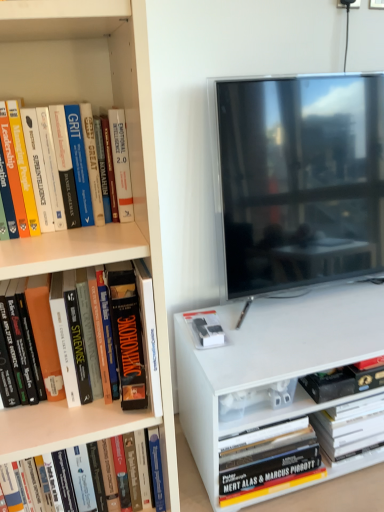
Question: From the image's perspective, is black matte book at lower right, which ranks as the second book in right-to-left order, located above or below hardcover book at lower left, positioned as the third book in back-to-front order?

Choices:
 (A) below
 (B) above

Answer: (B)

Question: Considering the positions of black matte book at lower right, which is the second book from back to front, and hardcover book at lower left, marked as the 2th book in a left-to-right arrangement, in the image, is black matte book at lower right, which is the second book from back to front, taller or shorter than hardcover book at lower left, marked as the 2th book in a left-to-right arrangement,?

Choices:
 (A) tall
 (B) short

Answer: (B)

Question: Estimate the real-world distances between objects in this image. Which object is closer to the orange matte book at left, which ranks as the 1th book in front-to-back order?

Choices:
 (A) flat-screen tv at right
 (B) hardcover book at lower right, which is counted as the first book, starting from the back
 (C) hardcover book at lower left, marked as the 2th book in a left-to-right arrangement
 (D) black matte book at lower right, which is the second book from back to front

Answer: (C)

Question: Which is nearer to the flat-screen tv at right?

Choices:
 (A) hardcover book at lower right, which is counted as the first book, starting from the back
 (B) orange matte book at left, placed as the fourth book when sorted from right to left
 (C) black matte book at lower right, which is the third book in left-to-right order
 (D) hardcover book at lower left, which appears as the 2th book when viewed from the front

Answer: (C)